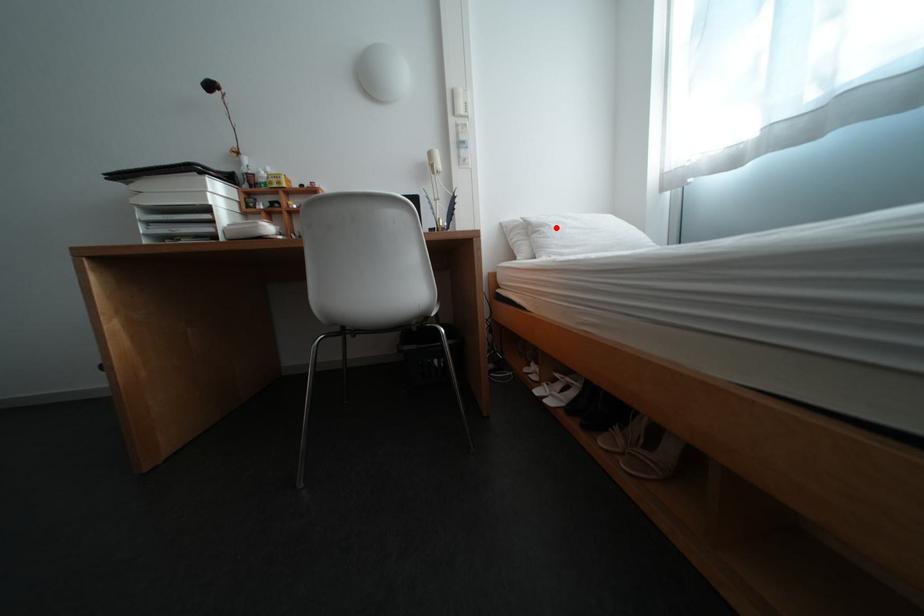
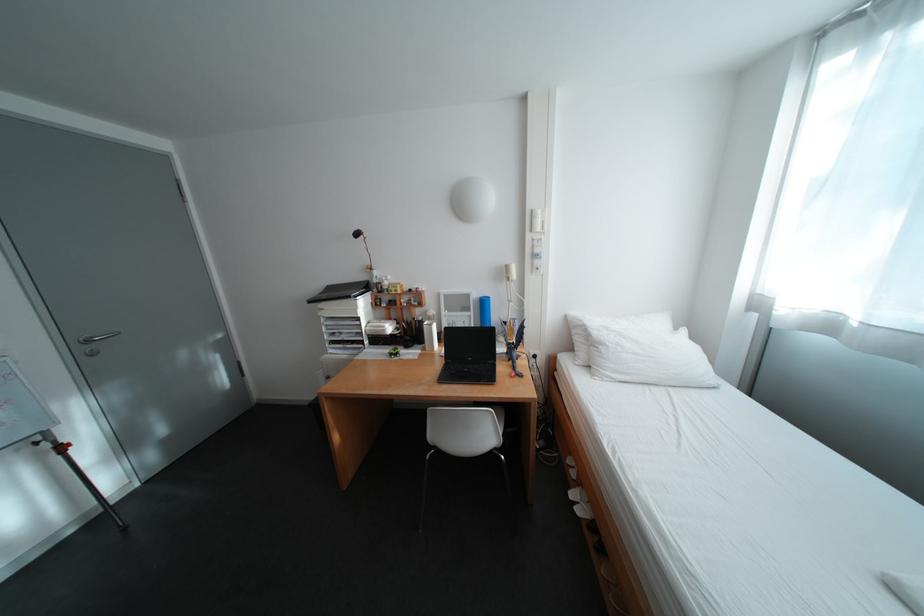
Find the pixel in the second image that matches the highlighted location in the first image.

(614, 346)